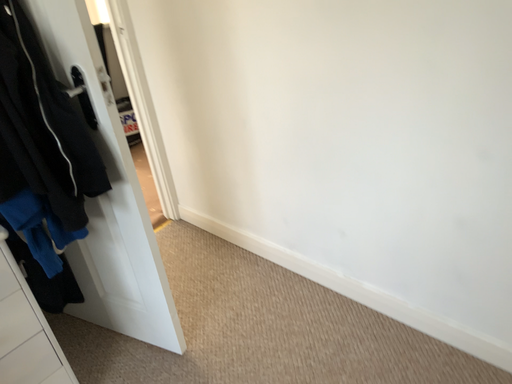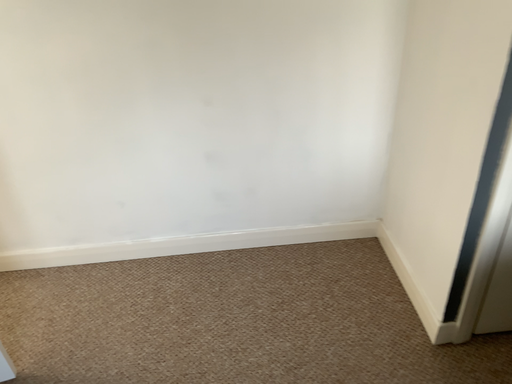
Question: How did the camera likely rotate when shooting the video?

Choices:
 (A) rotated left
 (B) rotated right

Answer: (B)